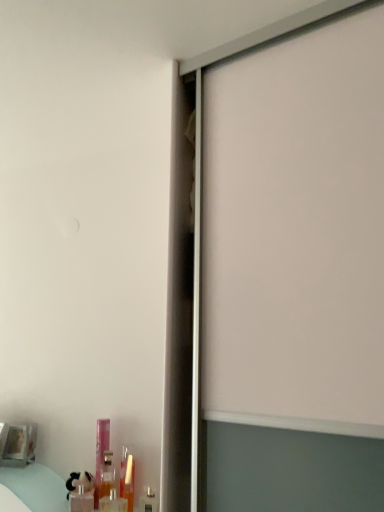
Describe the element at coordinates (106, 477) in the screenshot. I see `translucent plastic bottle at lower left, placed as the third toiletry when sorted from left to right` at that location.

Identify the location of translucent plastic bottle at lower left, placed as the 5th toiletry when sorted from right to left. (81, 498).

The height and width of the screenshot is (512, 384). I want to click on translucent plastic tube at lower left, marked as the 2th toiletry in a right-to-left arrangement, so 129,483.

Is the position of translucent plastic bottle at lower left, placed as the third toiletry when sorted from left to right, more distant than that of translucent plastic bottle at lower left, arranged as the first toiletry when viewed from the left?

Yes, translucent plastic bottle at lower left, placed as the third toiletry when sorted from left to right, is further from the camera.

In terms of width, does translucent plastic bottle at lower left, placed as the third toiletry when sorted from left to right, look wider or thinner when compared to translucent plastic bottle at lower left, placed as the 5th toiletry when sorted from right to left?

Considering their sizes, translucent plastic bottle at lower left, placed as the third toiletry when sorted from left to right, looks broader than translucent plastic bottle at lower left, placed as the 5th toiletry when sorted from right to left.

This screenshot has height=512, width=384. Identify the location of toiletry that is the 2nd one below the translucent plastic bottle at lower left, placed as the third toiletry when sorted from left to right (from a real-world perspective). (81, 498).

Considering the sizes of objects translucent plastic tube at lower left, marked as the 2th toiletry in a right-to-left arrangement, and translucent plastic bottle at lower left, placed as the third toiletry when sorted from left to right, in the image provided, who is bigger, translucent plastic tube at lower left, marked as the 2th toiletry in a right-to-left arrangement, or translucent plastic bottle at lower left, placed as the third toiletry when sorted from left to right,?

With larger size is translucent plastic bottle at lower left, placed as the third toiletry when sorted from left to right.

Considering the positions of objects translucent plastic tube at lower left, which is the 4th toiletry in left-to-right order, and translucent plastic bottle at lower left, placed as the 3th toiletry when sorted from right to left, in the image provided, who is in front, translucent plastic tube at lower left, which is the 4th toiletry in left-to-right order, or translucent plastic bottle at lower left, placed as the 3th toiletry when sorted from right to left,?

translucent plastic tube at lower left, which is the 4th toiletry in left-to-right order, is closer to the camera.

How many degrees apart are the facing directions of translucent plastic tube at lower left, which is the 4th toiletry in left-to-right order, and translucent plastic bottle at lower left, placed as the third toiletry when sorted from left to right?

The angular difference between translucent plastic tube at lower left, which is the 4th toiletry in left-to-right order, and translucent plastic bottle at lower left, placed as the third toiletry when sorted from left to right, is 2.34 degrees.

Is translucent plastic tube at lower left, which is the 4th toiletry in left-to-right order, located outside translucent plastic bottle at lower left, placed as the third toiletry when sorted from left to right?

Yes, translucent plastic tube at lower left, which is the 4th toiletry in left-to-right order, is located beyond the bounds of translucent plastic bottle at lower left, placed as the third toiletry when sorted from left to right.

Is translucent plastic tube at lower left, which is the 4th toiletry in left-to-right order, facing towards metallic silver toiletry at lower left, which is counted as the fifth toiletry, starting from the left?

No.

Does point (131, 481) appear closer or farther from the camera than point (157, 507)?

Point (131, 481).

How different are the orientations of translucent plastic tube at lower left, marked as the 2th toiletry in a right-to-left arrangement, and metallic silver toiletry at lower left, which is counted as the fifth toiletry, starting from the left, in degrees?

They differ by 3.26 degrees in their facing directions.

Can you confirm if pink plastic bottle at lower left, the second toiletry in the left-to-right sequence, is smaller than translucent plastic tube at lower left, marked as the 2th toiletry in a right-to-left arrangement?

No.

Consider the image. From a real-world perspective, does pink plastic bottle at lower left, the second toiletry in the left-to-right sequence, sit lower than translucent plastic tube at lower left, marked as the 2th toiletry in a right-to-left arrangement?

No.

Is point (96, 492) closer or farther from the camera than point (133, 462)?

Clearly, point (96, 492) is closer to the camera than point (133, 462).

From the translucent plastic tube at lower left, which is the 4th toiletry in left-to-right order, count 3rd toiletrys backward and point to it. Please provide its 2D coordinates.

[(100, 451)]

From the image's perspective, is translucent plastic bottle at lower left, placed as the third toiletry when sorted from left to right, positioned above or below translucent plastic tube at lower left, which is the 4th toiletry in left-to-right order?

Clearly, from the image's perspective, translucent plastic bottle at lower left, placed as the third toiletry when sorted from left to right, is below translucent plastic tube at lower left, which is the 4th toiletry in left-to-right order.

Is translucent plastic bottle at lower left, placed as the third toiletry when sorted from left to right, looking in the opposite direction of translucent plastic tube at lower left, which is the 4th toiletry in left-to-right order?

No, translucent plastic bottle at lower left, placed as the third toiletry when sorted from left to right, is not facing away from translucent plastic tube at lower left, which is the 4th toiletry in left-to-right order.

Which is in front, translucent plastic bottle at lower left, placed as the 3th toiletry when sorted from right to left, or translucent plastic tube at lower left, which is the 4th toiletry in left-to-right order?

translucent plastic tube at lower left, which is the 4th toiletry in left-to-right order, is more forward.

In the scene shown: Would you consider metallic silver toiletry at lower left, placed as the first toiletry when sorted from right to left, to be distant from translucent plastic bottle at lower left, placed as the third toiletry when sorted from left to right?

No.

From a real-world perspective, between metallic silver toiletry at lower left, which is counted as the fifth toiletry, starting from the left, and translucent plastic bottle at lower left, placed as the third toiletry when sorted from left to right, who is vertically lower?

metallic silver toiletry at lower left, which is counted as the fifth toiletry, starting from the left, is physically lower.

Is metallic silver toiletry at lower left, which is counted as the fifth toiletry, starting from the left, bigger or smaller than translucent plastic bottle at lower left, placed as the third toiletry when sorted from left to right?

In the image, metallic silver toiletry at lower left, which is counted as the fifth toiletry, starting from the left, appears to be smaller than translucent plastic bottle at lower left, placed as the third toiletry when sorted from left to right.

Could translucent plastic bottle at lower left, placed as the third toiletry when sorted from left to right, be considered to be inside metallic silver toiletry at lower left, placed as the first toiletry when sorted from right to left?

No, translucent plastic bottle at lower left, placed as the third toiletry when sorted from left to right, is not surrounded by metallic silver toiletry at lower left, placed as the first toiletry when sorted from right to left.

Could you measure the distance between pink plastic bottle at lower left, the 4th toiletry positioned from the right, and translucent plastic bottle at lower left, placed as the third toiletry when sorted from left to right?

pink plastic bottle at lower left, the 4th toiletry positioned from the right, and translucent plastic bottle at lower left, placed as the third toiletry when sorted from left to right, are 1.34 inches apart from each other.

Is pink plastic bottle at lower left, the second toiletry in the left-to-right sequence, oriented away from translucent plastic bottle at lower left, placed as the third toiletry when sorted from left to right?

No, pink plastic bottle at lower left, the second toiletry in the left-to-right sequence, is not facing the opposite direction of translucent plastic bottle at lower left, placed as the third toiletry when sorted from left to right.

Can you confirm if pink plastic bottle at lower left, the second toiletry in the left-to-right sequence, is positioned to the left of translucent plastic bottle at lower left, placed as the 3th toiletry when sorted from right to left?

Yes.

Looking at this image, is pink plastic bottle at lower left, the 4th toiletry positioned from the right, positioned in front of translucent plastic bottle at lower left, placed as the 3th toiletry when sorted from right to left?

No, pink plastic bottle at lower left, the 4th toiletry positioned from the right, is further to the viewer.

Find the location of a particular element. Image resolution: width=384 pixels, height=512 pixels. the 2nd toiletry below the translucent plastic bottle at lower left, placed as the third toiletry when sorted from left to right (from a real-world perspective) is located at coordinates (81, 498).

From a real-world perspective, starting from the translucent plastic bottle at lower left, placed as the 3th toiletry when sorted from right to left, which toiletry is the 1st one vertically above it? Please provide its 2D coordinates.

[(129, 483)]

Considering their positions, is translucent plastic bottle at lower left, placed as the 5th toiletry when sorted from right to left, positioned further to pink plastic bottle at lower left, the second toiletry in the left-to-right sequence, than translucent plastic tube at lower left, marked as the 2th toiletry in a right-to-left arrangement?

Among the two, translucent plastic tube at lower left, marked as the 2th toiletry in a right-to-left arrangement, is located further to pink plastic bottle at lower left, the second toiletry in the left-to-right sequence.

Based on their spatial positions, is translucent plastic bottle at lower left, placed as the 3th toiletry when sorted from right to left, or metallic silver toiletry at lower left, which is counted as the fifth toiletry, starting from the left, further from translucent plastic tube at lower left, which is the 4th toiletry in left-to-right order?

metallic silver toiletry at lower left, which is counted as the fifth toiletry, starting from the left, is further to translucent plastic tube at lower left, which is the 4th toiletry in left-to-right order.

Estimate the real-world distances between objects in this image. Which object is further from pink plastic bottle at lower left, the 4th toiletry positioned from the right, translucent plastic bottle at lower left, placed as the 3th toiletry when sorted from right to left, or metallic silver toiletry at lower left, which is counted as the fifth toiletry, starting from the left?

Based on the image, metallic silver toiletry at lower left, which is counted as the fifth toiletry, starting from the left, appears to be further to pink plastic bottle at lower left, the 4th toiletry positioned from the right.

Estimate the real-world distances between objects in this image. Which object is further from translucent plastic bottle at lower left, placed as the 3th toiletry when sorted from right to left, translucent plastic tube at lower left, which is the 4th toiletry in left-to-right order, or pink plastic bottle at lower left, the 4th toiletry positioned from the right?

Based on the image, translucent plastic tube at lower left, which is the 4th toiletry in left-to-right order, appears to be further to translucent plastic bottle at lower left, placed as the 3th toiletry when sorted from right to left.

From the image, which object appears to be nearer to translucent plastic tube at lower left, marked as the 2th toiletry in a right-to-left arrangement, pink plastic bottle at lower left, the 4th toiletry positioned from the right, or translucent plastic bottle at lower left, placed as the third toiletry when sorted from left to right?

Among the two, translucent plastic bottle at lower left, placed as the third toiletry when sorted from left to right, is located nearer to translucent plastic tube at lower left, marked as the 2th toiletry in a right-to-left arrangement.

When comparing their distances from translucent plastic tube at lower left, which is the 4th toiletry in left-to-right order, does metallic silver toiletry at lower left, which is counted as the fifth toiletry, starting from the left, or translucent plastic bottle at lower left, placed as the 3th toiletry when sorted from right to left, seem closer?

translucent plastic bottle at lower left, placed as the 3th toiletry when sorted from right to left, is positioned closer to the anchor translucent plastic tube at lower left, which is the 4th toiletry in left-to-right order.

Based on their spatial positions, is translucent plastic bottle at lower left, placed as the third toiletry when sorted from left to right, or translucent plastic tube at lower left, marked as the 2th toiletry in a right-to-left arrangement, further from translucent plastic bottle at lower left, arranged as the first toiletry when viewed from the left?

Among the two, translucent plastic tube at lower left, marked as the 2th toiletry in a right-to-left arrangement, is located further to translucent plastic bottle at lower left, arranged as the first toiletry when viewed from the left.

Estimate the real-world distances between objects in this image. Which object is further from translucent plastic tube at lower left, marked as the 2th toiletry in a right-to-left arrangement, translucent plastic bottle at lower left, arranged as the first toiletry when viewed from the left, or metallic silver toiletry at lower left, placed as the first toiletry when sorted from right to left?

The object further to translucent plastic tube at lower left, marked as the 2th toiletry in a right-to-left arrangement, is translucent plastic bottle at lower left, arranged as the first toiletry when viewed from the left.

What are the coordinates of `toiletry situated between translucent plastic bottle at lower left, placed as the third toiletry when sorted from left to right, and metallic silver toiletry at lower left, which is counted as the fifth toiletry, starting from the left, from left to right` in the screenshot? It's located at (129, 483).

Where is `toiletry located between pink plastic bottle at lower left, the 4th toiletry positioned from the right, and translucent plastic tube at lower left, which is the 4th toiletry in left-to-right order, in the left-right direction`? This screenshot has height=512, width=384. toiletry located between pink plastic bottle at lower left, the 4th toiletry positioned from the right, and translucent plastic tube at lower left, which is the 4th toiletry in left-to-right order, in the left-right direction is located at coordinates (106, 477).